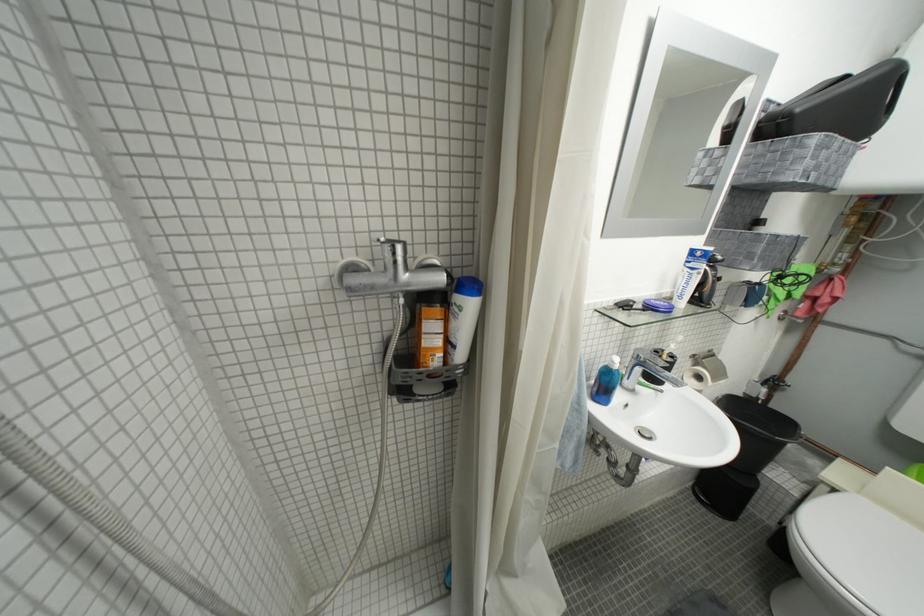
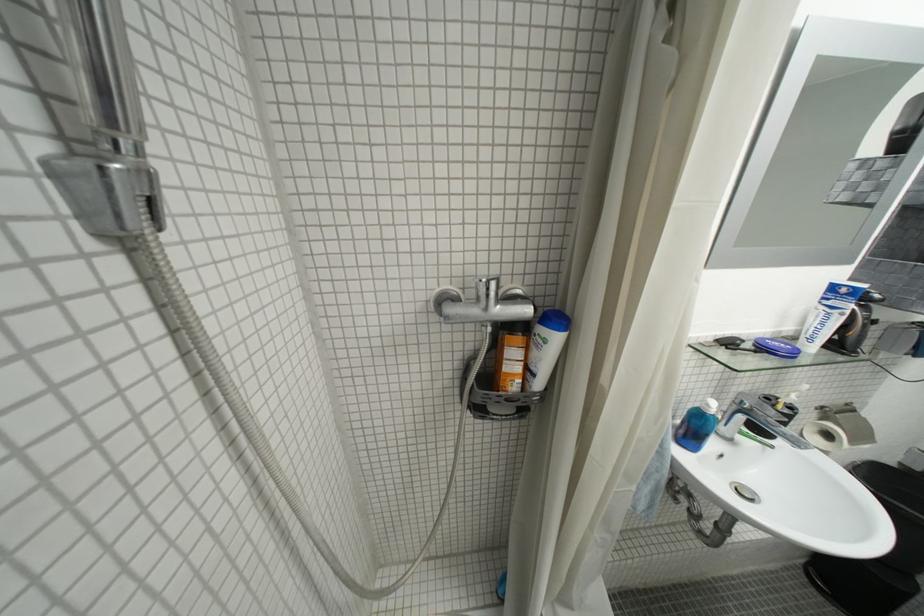
Where in the second image is the point corresponding to point 405,265 from the first image?

(496, 298)